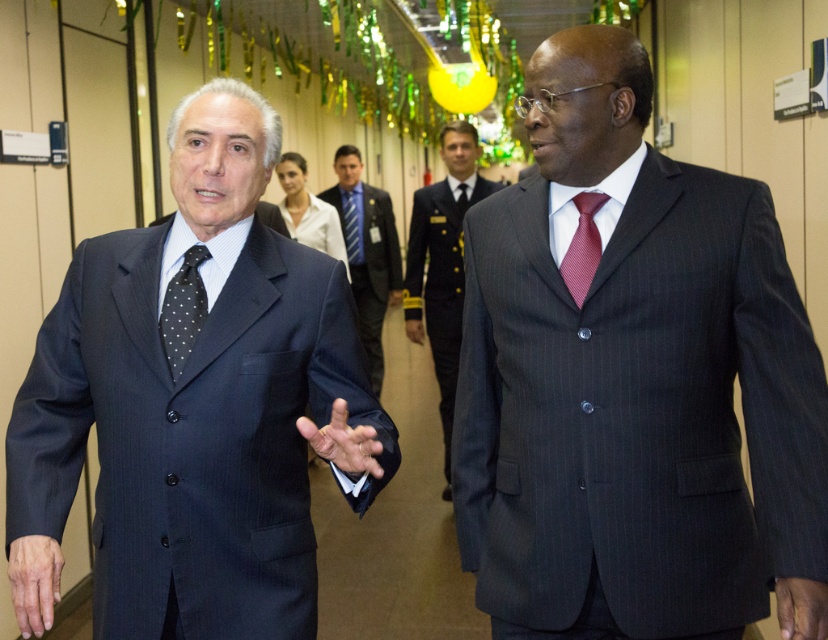
You are a photographer at a corporate event and need to capture a clear photo of the matte black suit at left and the red textured tie at center. Since the camera can only focus on one subject at a time, which subject should you focus on to ensure the other is still in the background?

You should focus on the matte black suit at left because it is in front of the red textured tie at center, so the red textured tie at center will be in the background.

You are a tailor observing two men in the center of the image. You need to determine which tie, the red textured tie at center or the dark blue silk tie at center, requires more fabric to make. Based on their widths, which one would need more material?

The red textured tie at center has a greater width than the dark blue silk tie at center, so it would require more fabric to make.

You are organizing a photo shoot and need to ensure that both the red textured tie at center and the dark blue silk tie at center are visible in the final image. Based on their positions, which tie should you focus on to ensure both are in frame?

You should focus on the red textured tie at center because it is in front of the dark blue silk tie at center, making it easier to capture both in the frame.